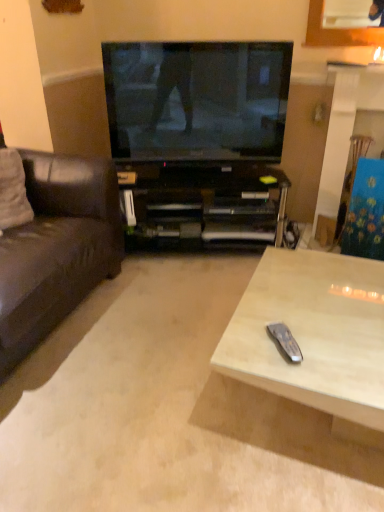
Question: Is light wood/texture remote control at lower right surrounded by brown leather couch at left?

Choices:
 (A) no
 (B) yes

Answer: (A)

Question: Is brown leather couch at left not near light wood/texture remote control at lower right?

Choices:
 (A) yes
 (B) no

Answer: (B)

Question: Considering the relative sizes of brown leather couch at left and light wood/texture remote control at lower right in the image provided, is brown leather couch at left smaller than light wood/texture remote control at lower right?

Choices:
 (A) no
 (B) yes

Answer: (A)

Question: From the image's perspective, is brown leather couch at left on light wood/texture remote control at lower right?

Choices:
 (A) no
 (B) yes

Answer: (B)

Question: Considering the relative positions of brown leather couch at left and light wood/texture remote control at lower right in the image provided, is brown leather couch at left behind light wood/texture remote control at lower right?

Choices:
 (A) no
 (B) yes

Answer: (B)

Question: Is brown leather couch at left located outside light wood/texture remote control at lower right?

Choices:
 (A) no
 (B) yes

Answer: (B)

Question: Does wooden coffee table at center come behind brown leather couch at left?

Choices:
 (A) yes
 (B) no

Answer: (B)

Question: Considering the relative sizes of wooden coffee table at center and brown leather couch at left in the image provided, is wooden coffee table at center smaller than brown leather couch at left?

Choices:
 (A) no
 (B) yes

Answer: (B)

Question: From a real-world perspective, is wooden coffee table at center below brown leather couch at left?

Choices:
 (A) yes
 (B) no

Answer: (A)

Question: From a real-world perspective, is wooden coffee table at center positioned over brown leather couch at left based on gravity?

Choices:
 (A) yes
 (B) no

Answer: (B)

Question: Is wooden coffee table at center placed right next to brown leather couch at left?

Choices:
 (A) yes
 (B) no

Answer: (B)

Question: Could you tell me if wooden coffee table at center is facing brown leather couch at left?

Choices:
 (A) no
 (B) yes

Answer: (A)

Question: Does black plastic cabinet at center appear on the right side of white fabric pillow at left?

Choices:
 (A) no
 (B) yes

Answer: (B)